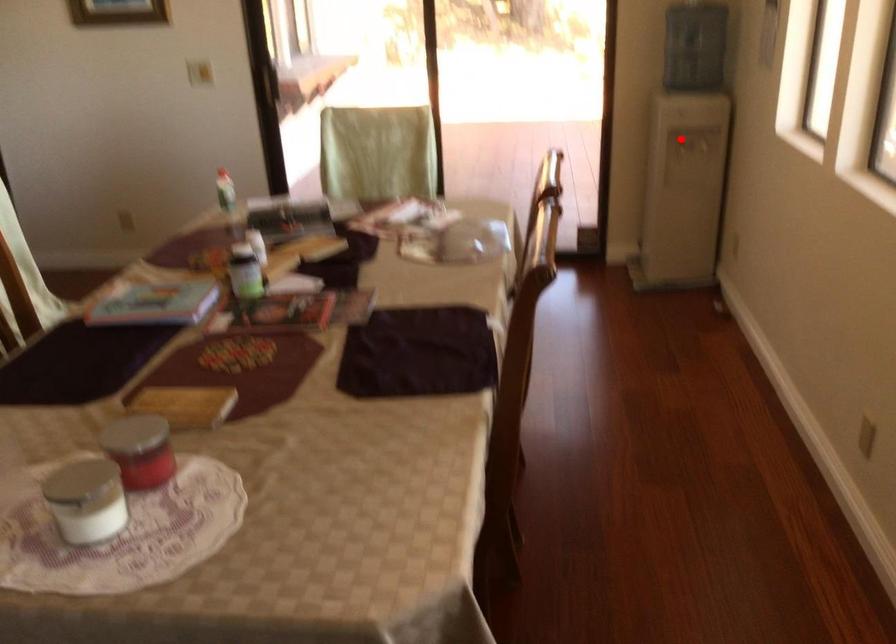
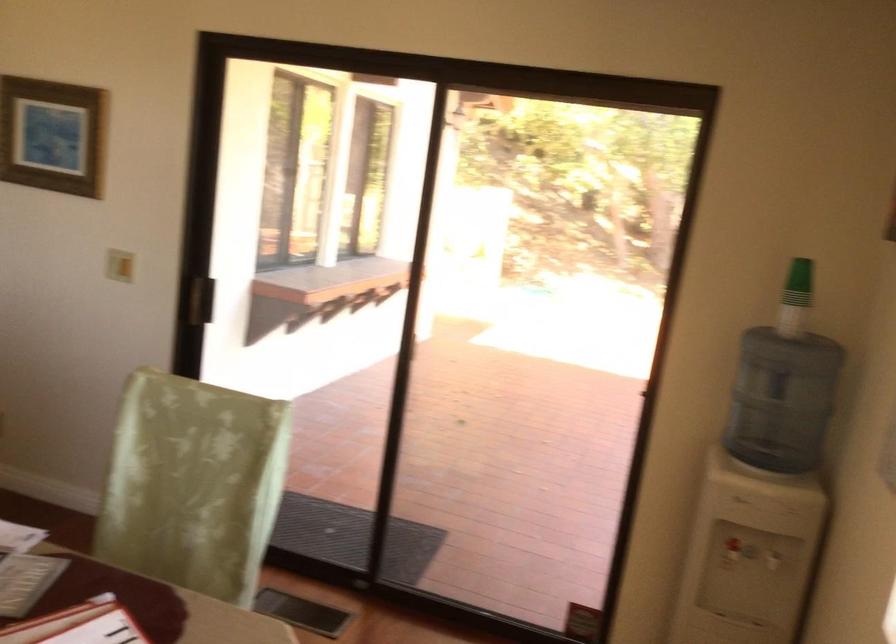
Question: A red point is marked in image1. In image2, is the corresponding 3D point closer to the camera or farther? Reply with the corresponding letter.

Choices:
 (A) The corresponding 3D point is closer.
 (B) The corresponding 3D point is farther.

Answer: (A)